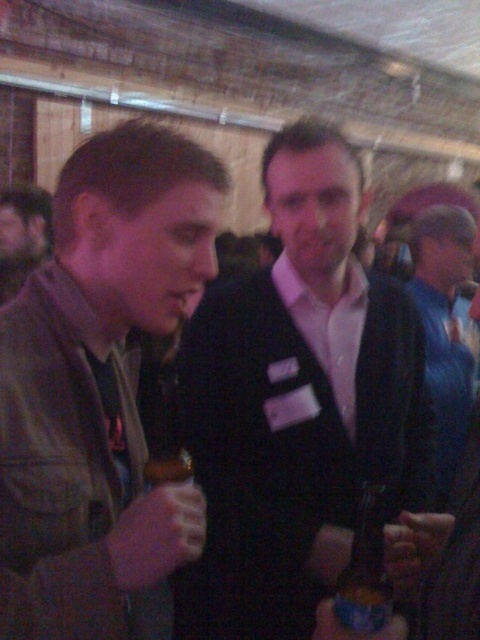
Is blue glass bottle at center smaller than brown leather jacket at center?

Correct, blue glass bottle at center occupies less space than brown leather jacket at center.

Which of these two, blue glass bottle at center or brown leather jacket at center, stands shorter?

Standing shorter between the two is blue glass bottle at center.

Locate an element on the screen. blue glass bottle at center is located at coordinates (365, 570).

You are a GUI agent. You are given a task and a screenshot of the screen. Output one action in this format:
    pyautogui.click(x=<x>, y=<y>)
    Task: Click on the blue glass bottle at center
    This screenshot has height=640, width=480.
    Given the screenshot: What is the action you would take?
    pyautogui.click(x=365, y=570)

Is leather jacket at left further to the viewer compared to brown leather jacket at center?

No, leather jacket at left is in front of brown leather jacket at center.

The height and width of the screenshot is (640, 480). Describe the element at coordinates (98, 385) in the screenshot. I see `leather jacket at left` at that location.

The height and width of the screenshot is (640, 480). I want to click on leather jacket at left, so click(98, 385).

Is black matte suit at center smaller than leather jacket at left?

Incorrect, black matte suit at center is not smaller in size than leather jacket at left.

Is black matte suit at center positioned behind leather jacket at left?

Yes.

This screenshot has height=640, width=480. I want to click on black matte suit at center, so click(x=297, y=403).

You are a GUI agent. You are given a task and a screenshot of the screen. Output one action in this format:
    pyautogui.click(x=<x>, y=<y>)
    Task: Click on the black matte suit at center
    The height and width of the screenshot is (640, 480).
    Given the screenshot: What is the action you would take?
    pyautogui.click(x=297, y=403)